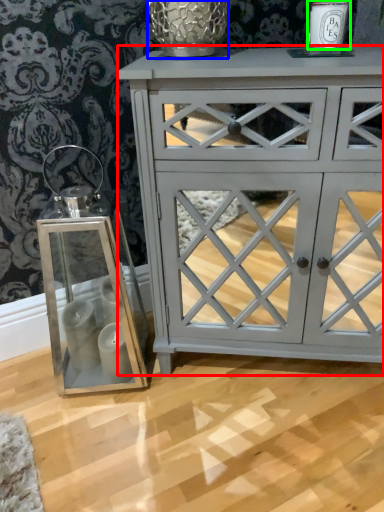
Question: Which object is positioned closest to chest of drawers (highlighted by a red box)? Select from glass vase (highlighted by a blue box) and candle holder (highlighted by a green box).

Choices:
 (A) glass vase
 (B) candle holder

Answer: (A)